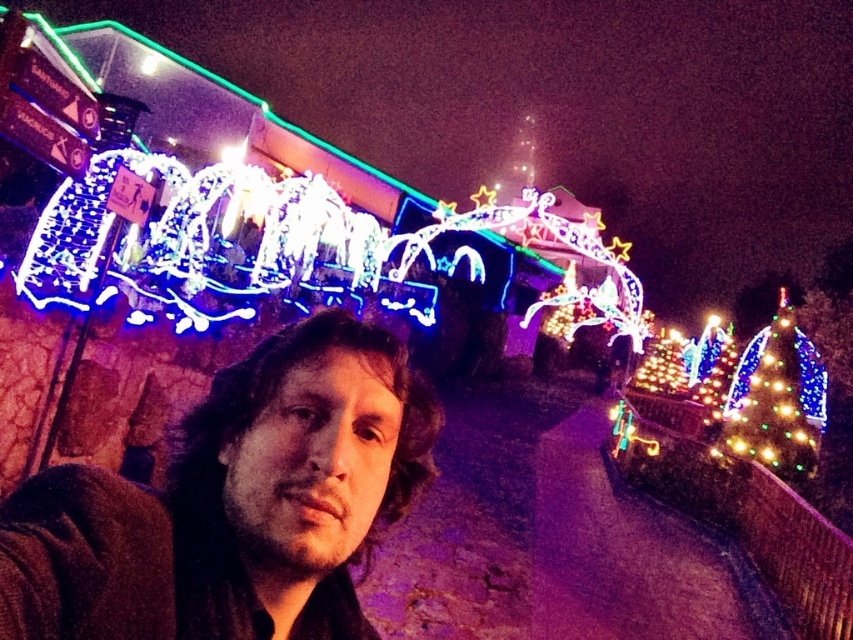
Question: Is matte black jacket at center to the right of multicolored lights at right from the viewer's perspective?

Choices:
 (A) yes
 (B) no

Answer: (B)

Question: Does matte black jacket at center have a greater width compared to multicolored lights at right?

Choices:
 (A) yes
 (B) no

Answer: (B)

Question: Is matte black jacket at center to the left of multicolored lights at right from the viewer's perspective?

Choices:
 (A) no
 (B) yes

Answer: (B)

Question: Which object appears closest to the camera in this image?

Choices:
 (A) multicolored lights at right
 (B) matte black jacket at center

Answer: (B)